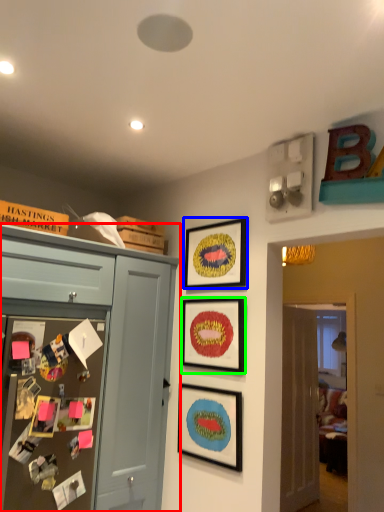
Question: Considering the real-world distances, which object is farthest from cabinetry (highlighted by a red box)? picture frame (highlighted by a blue box) or picture frame (highlighted by a green box)?

Choices:
 (A) picture frame
 (B) picture frame

Answer: (A)